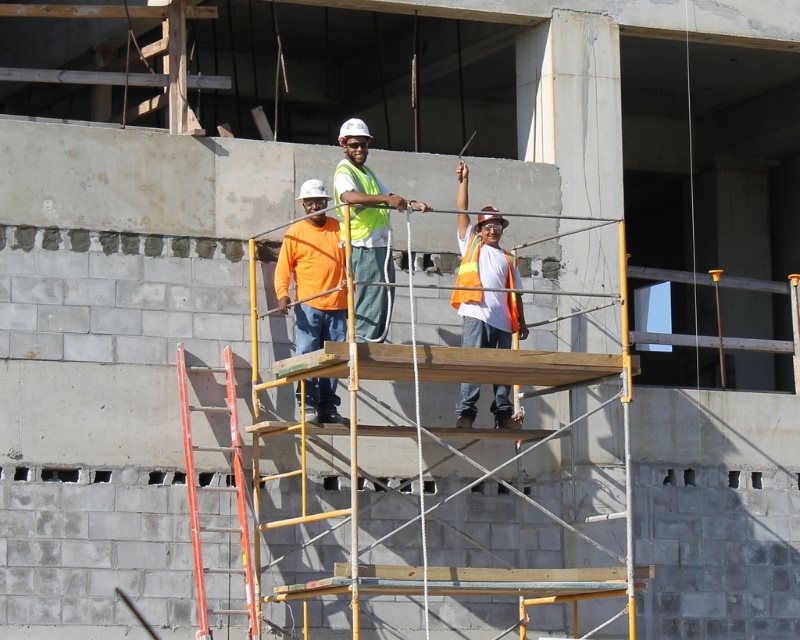
Question: Is orange matte shirt at center in front of orange painted wood ladder at left?

Choices:
 (A) no
 (B) yes

Answer: (A)

Question: Which point is farther to the camera?

Choices:
 (A) (498, 269)
 (B) (472, 387)

Answer: (B)

Question: Does orange matte shirt at center appear on the left side of high visibility vest at center?

Choices:
 (A) no
 (B) yes

Answer: (B)

Question: Which object appears closest to the camera in this image?

Choices:
 (A) orange matte shirt at center
 (B) orange painted wood ladder at left

Answer: (B)

Question: Which of the following is the farthest from the observer?

Choices:
 (A) orange painted wood ladder at left
 (B) orange matte shirt at center

Answer: (B)

Question: Can you confirm if orange reflective vest at center is positioned above orange reflective safety vest at center?

Choices:
 (A) yes
 (B) no

Answer: (B)